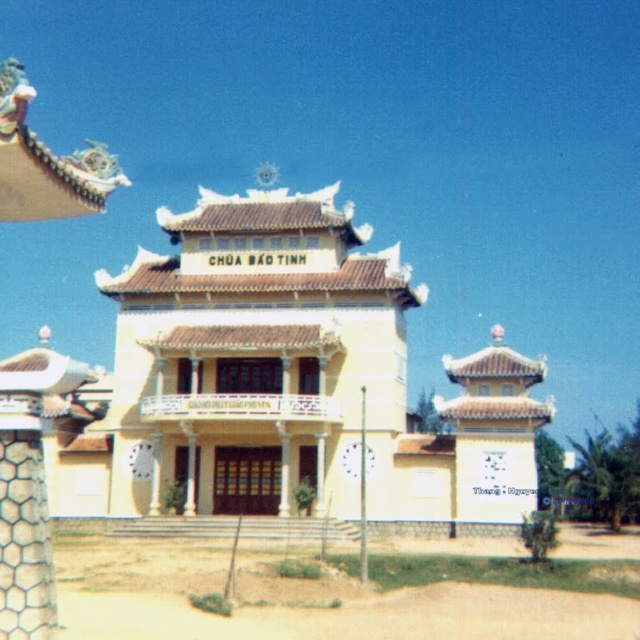
You are a tourist visiting the Temple of Faith. You notice the yellow matte building at center and the white hexagonal mesh at lower left in the scene. Which object is bigger in size?

The yellow matte building at center is larger in size compared to the white hexagonal mesh at lower left.